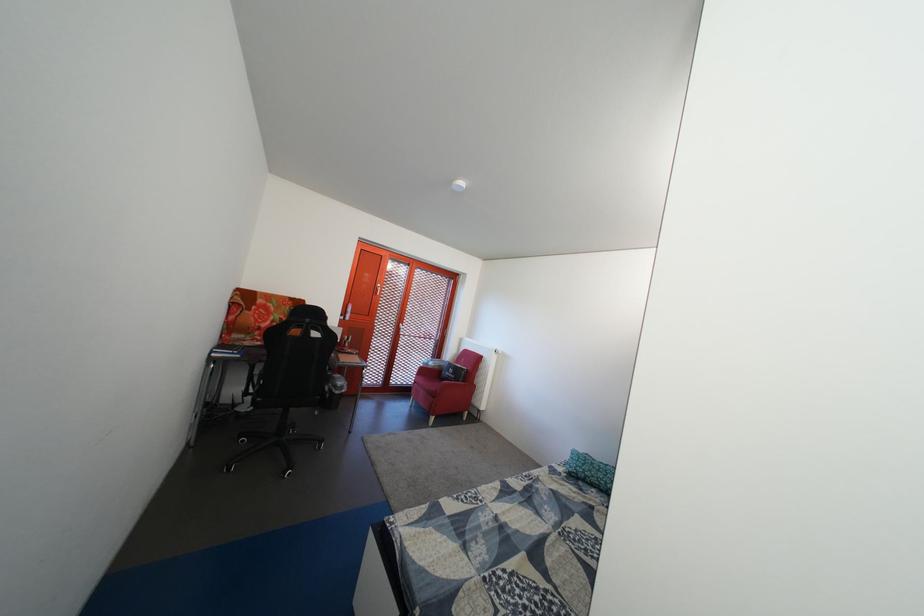
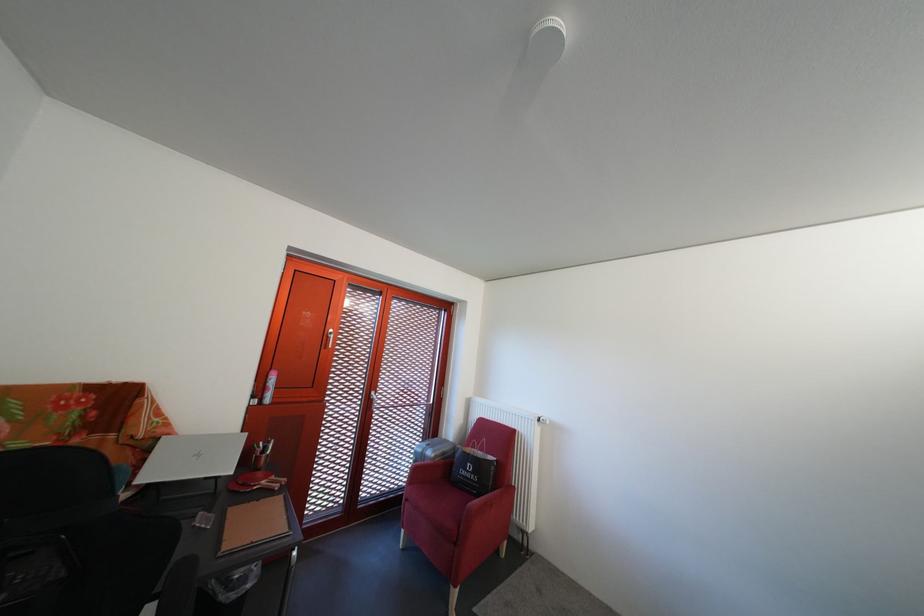
Question: The images are taken continuously from a first-person perspective. In which direction are you moving?

Choices:
 (A) Left
 (B) Right
 (C) Forward
 (D) Backward

Answer: (C)